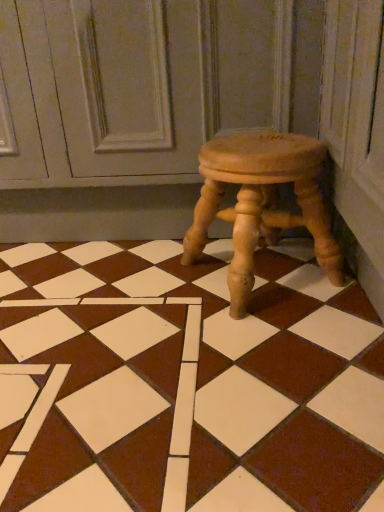
Describe the element at coordinates (262, 203) in the screenshot. The image size is (384, 512). I see `light brown wood stool at center` at that location.

You are a GUI agent. You are given a task and a screenshot of the screen. Output one action in this format:
    pyautogui.click(x=<x>, y=<y>)
    Task: Click on the light brown wood stool at center
    This screenshot has height=512, width=384.
    Given the screenshot: What is the action you would take?
    pyautogui.click(x=262, y=203)

What is the approximate width of light brown wood stool at center?

It is 9.72 inches.

Where is `light brown wood stool at center`? light brown wood stool at center is located at coordinates (262, 203).